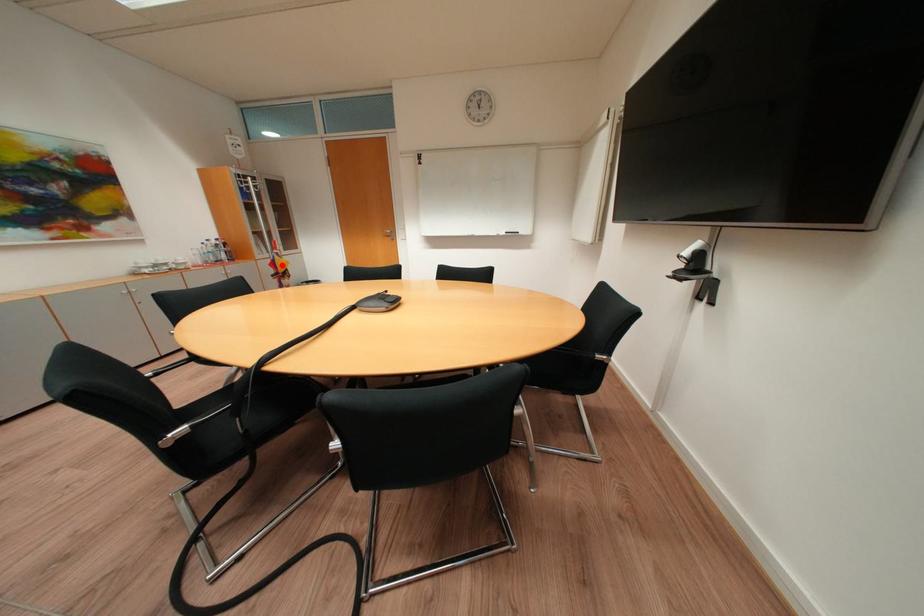
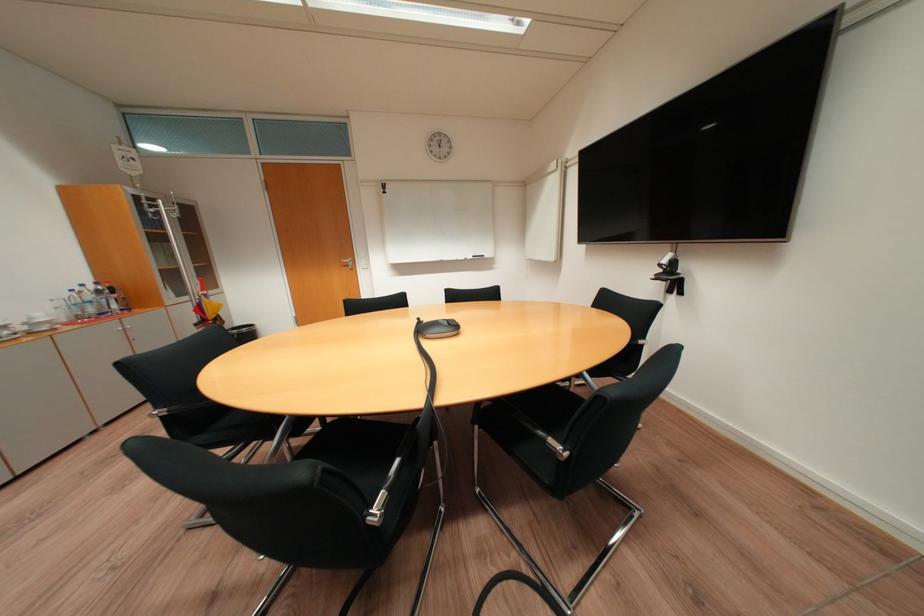
Question: I am providing you with two images of the same scene from different viewpoints. A red point is marked on the first image. At the location where the point appears in image 1, is it still visible in image 2?

Choices:
 (A) Yes
 (B) No

Answer: (A)